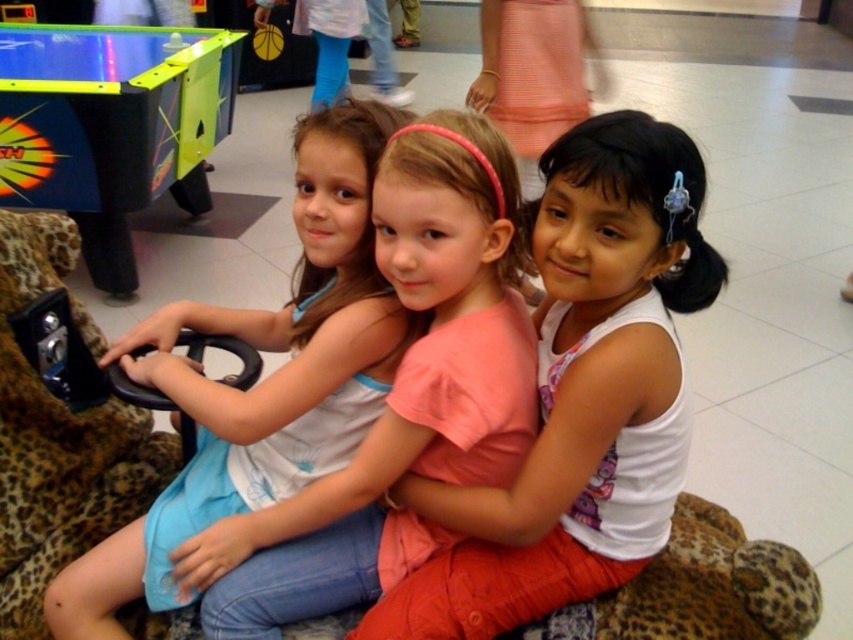
You are a photographer trying to capture a candid shot of the girls without them noticing. Since you want to focus on their upper bodies, which clothing item would you need to ensure is fully visible in the frame? The pink cotton shirt at center or the pink fabric dress at center?

The pink fabric dress at center is longer than the pink cotton shirt at center, so to ensure the entire upper body is visible, focus on the pink fabric dress at center as it extends lower and covers more area.

You are a photographer trying to capture a clear photo of both the pink cotton shirt at center and the pink fabric dress at center. Since you can only focus on one object at a time, which one should you focus on to ensure it appears sharp in the photo?

The pink cotton shirt at center is closer to the viewer than the pink fabric dress at center, so focusing on it will keep it sharp while the dress may appear slightly blurry. Alternatively, focusing on the dress would make it sharp but the shirt might be out of focus.